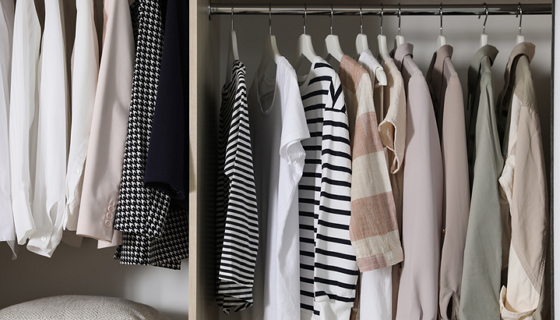
This screenshot has width=560, height=320. In order to click on hangers in this screenshot , I will do `click(231, 29)`, `click(270, 31)`, `click(304, 29)`, `click(334, 29)`, `click(358, 29)`, `click(381, 29)`, `click(395, 29)`, `click(442, 29)`, `click(482, 31)`, `click(520, 27)`.